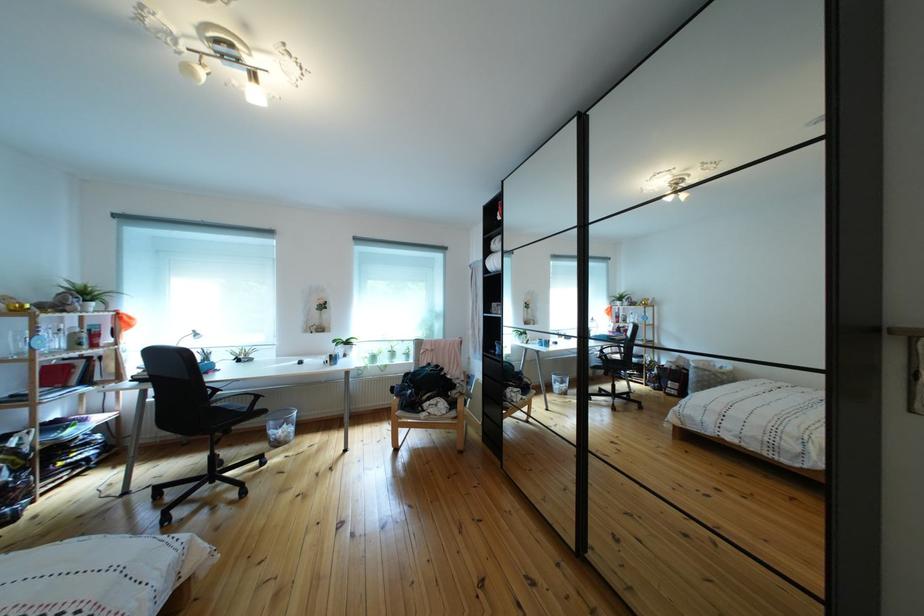
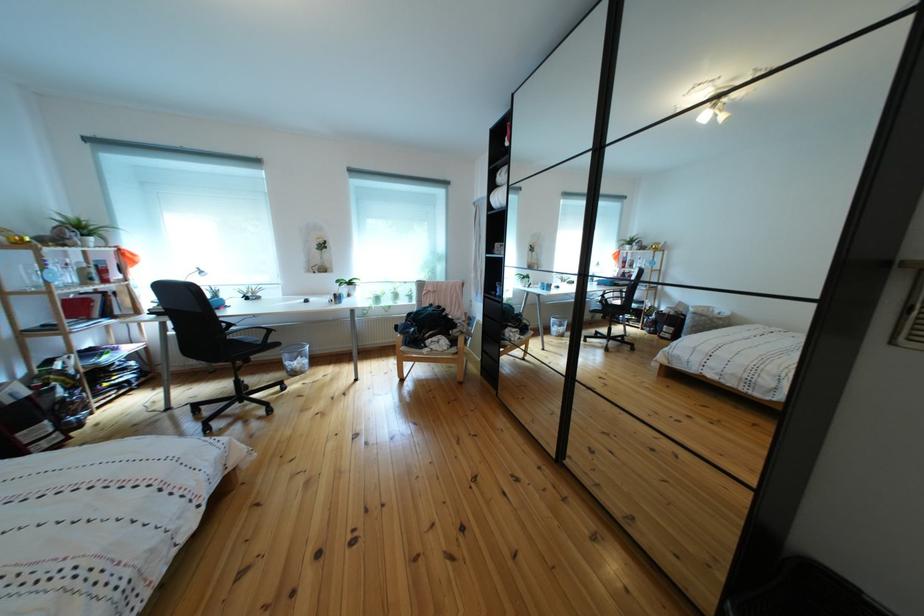
Question: I am providing you with two images of the same scene from different viewpoints. Please identify which objects are invisible in image2.

Choices:
 (A) wooden chair armrest
 (B) black chair armrest
 (C) mesh trash can
 (D) none of these

Answer: (D)